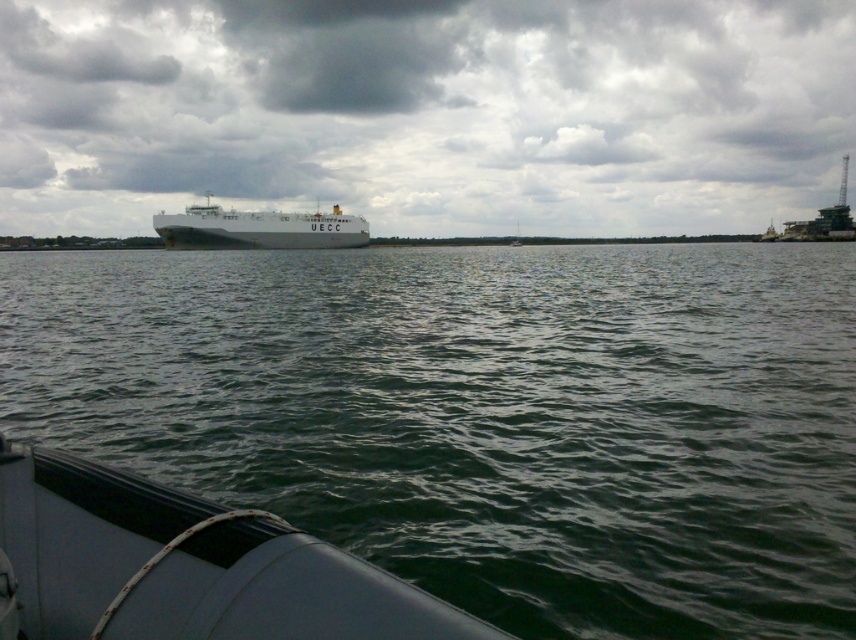
You are standing on the deck of the white matte ship at center and want to observe the greenish water at center. In which direction should you look relative to the ship?

You should look to the right of the white matte ship at center to see the greenish water at center.

You are standing on the deck of the UECC cargo ship and looking out towards the horizon. There is a point marked at coordinates (483, 416). What is located at that point?

The point at coordinates (483, 416) is occupied by greenish water at center.

You are standing on the deck of the UECC cargo ship and looking out. Which of the two, the greenish water at center or the gray cloudy sky at upper center, appears narrower from your viewpoint?

The greenish water at center appears narrower because it has a lesser width compared to the gray cloudy sky at upper center.